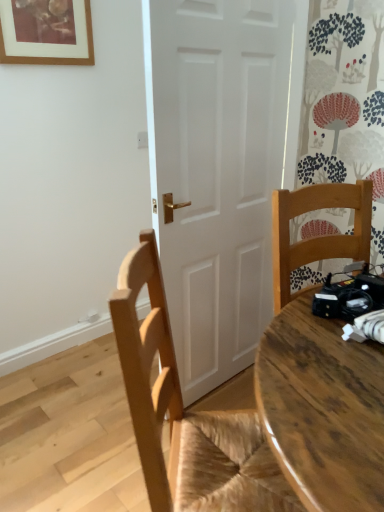
Question: In the image, is matte wooden picture frame at upper left positioned in front of or behind wooden chair at center?

Choices:
 (A) front
 (B) behind

Answer: (B)

Question: Considering the positions of matte wooden picture frame at upper left and wooden chair at center in the image, is matte wooden picture frame at upper left taller or shorter than wooden chair at center?

Choices:
 (A) tall
 (B) short

Answer: (B)

Question: Considering the positions of point (84, 34) and point (248, 434), is point (84, 34) closer or farther from the camera than point (248, 434)?

Choices:
 (A) closer
 (B) farther

Answer: (B)

Question: Considering the positions of wooden chair at center and matte wooden picture frame at upper left in the image, is wooden chair at center taller or shorter than matte wooden picture frame at upper left?

Choices:
 (A) short
 (B) tall

Answer: (B)

Question: Does point (292, 500) appear closer or farther from the camera than point (6, 41)?

Choices:
 (A) farther
 (B) closer

Answer: (B)

Question: Choose the correct answer: Is wooden chair at center inside matte wooden picture frame at upper left or outside it?

Choices:
 (A) inside
 (B) outside

Answer: (B)

Question: Considering the positions of wooden chair at center and matte wooden picture frame at upper left in the image, is wooden chair at center bigger or smaller than matte wooden picture frame at upper left?

Choices:
 (A) small
 (B) big

Answer: (B)